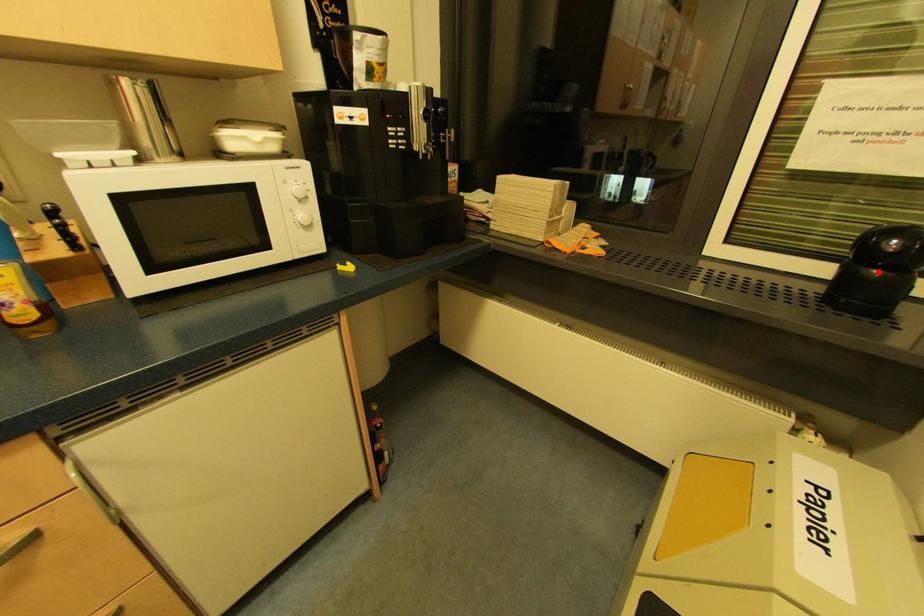
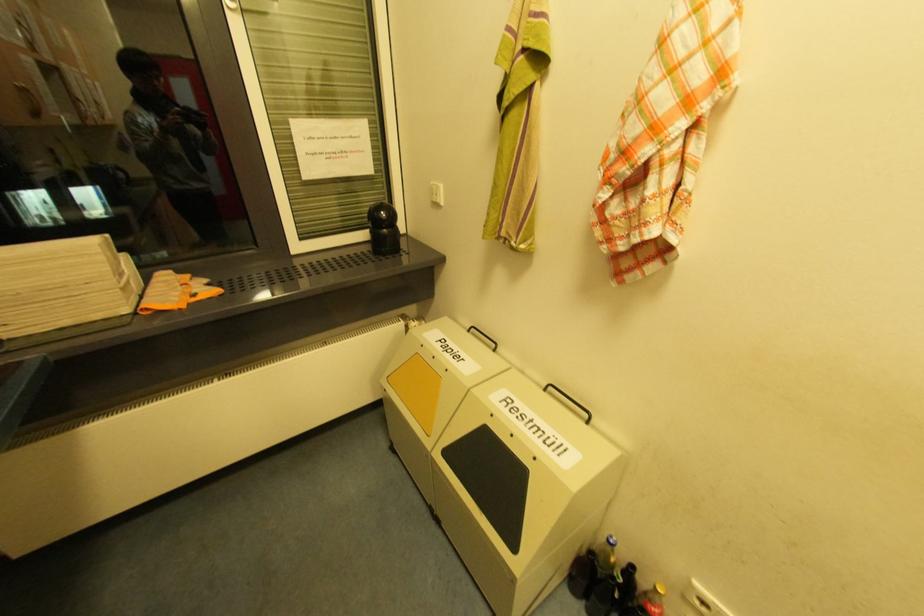
In the second image, find the point that corresponds to the highlighted location in the first image.

(388, 230)